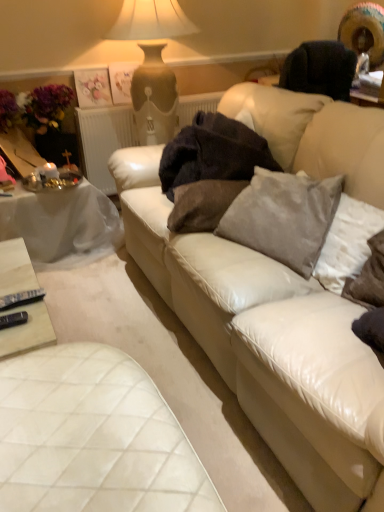
Question: Is velvet gray pillow at center, placed as the 3th pillow when sorted from right to left, far away from white quilted leather table at lower left, acting as the 1th table starting from the front?

Choices:
 (A) yes
 (B) no

Answer: (B)

Question: Is velvet gray pillow at center, placed as the 1th pillow when sorted from left to right, to the right of white quilted leather table at lower left, acting as the 1th table starting from the front, from the viewer's perspective?

Choices:
 (A) yes
 (B) no

Answer: (A)

Question: Does velvet gray pillow at center, placed as the 1th pillow when sorted from left to right, lie behind white quilted leather table at lower left, placed as the 1th table when sorted from bottom to top?

Choices:
 (A) no
 (B) yes

Answer: (B)

Question: Considering the relative sizes of velvet gray pillow at center, placed as the 1th pillow when sorted from left to right, and white quilted leather table at lower left, the second table from the top, in the image provided, is velvet gray pillow at center, placed as the 1th pillow when sorted from left to right, thinner than white quilted leather table at lower left, the second table from the top,?

Choices:
 (A) no
 (B) yes

Answer: (B)

Question: Can you confirm if velvet gray pillow at center, placed as the 3th pillow when sorted from right to left, is positioned to the left of white quilted leather table at lower left, acting as the 1th table starting from the front?

Choices:
 (A) no
 (B) yes

Answer: (A)

Question: Is velvet gray pillow at center, placed as the 1th pillow when sorted from left to right, with white quilted leather table at lower left, the second table from the top?

Choices:
 (A) yes
 (B) no

Answer: (B)

Question: From the image's perspective, does white cloth-covered table at left, the second table viewed from the front, appear higher than gray velvety pillow at right, the third pillow positioned from the left?

Choices:
 (A) yes
 (B) no

Answer: (A)

Question: Considering the relative sizes of white cloth-covered table at left, acting as the first table starting from the top, and gray velvety pillow at right, the third pillow positioned from the left, in the image provided, is white cloth-covered table at left, acting as the first table starting from the top, taller than gray velvety pillow at right, the third pillow positioned from the left,?

Choices:
 (A) yes
 (B) no

Answer: (A)

Question: Could you tell me if white cloth-covered table at left, placed as the 1th table when sorted from back to front, is facing gray velvety pillow at right, the third pillow positioned from the left?

Choices:
 (A) no
 (B) yes

Answer: (B)

Question: Is gray velvety pillow at right, which is counted as the 1th pillow, starting from the right, located within white cloth-covered table at left, positioned as the second table in bottom-to-top order?

Choices:
 (A) no
 (B) yes

Answer: (A)

Question: Is the depth of white cloth-covered table at left, positioned as the second table in bottom-to-top order, less than that of gray velvety pillow at right, which is counted as the 1th pillow, starting from the right?

Choices:
 (A) no
 (B) yes

Answer: (A)

Question: Is white cloth-covered table at left, acting as the first table starting from the top, positioned with its back to gray velvety pillow at right, which is counted as the 1th pillow, starting from the right?

Choices:
 (A) yes
 (B) no

Answer: (B)

Question: Can you confirm if white textured radiator at upper center is wider than white cloth-covered table at left, acting as the first table starting from the top?

Choices:
 (A) no
 (B) yes

Answer: (A)